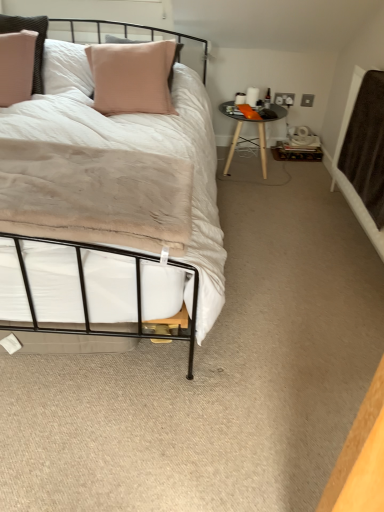
Image resolution: width=384 pixels, height=512 pixels. What are the coordinates of `free space to the right of black glossy table at center right` in the screenshot? It's located at (299, 175).